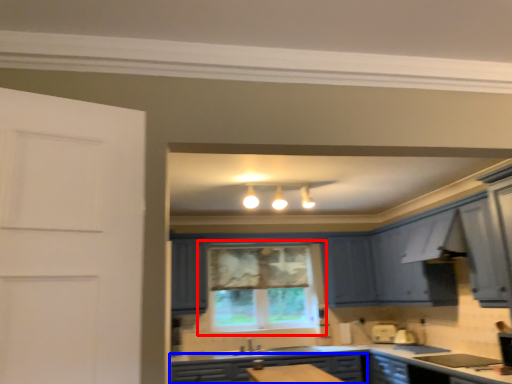
Question: Which point is closer to the camera, window (highlighted by a red box) or cabinetry (highlighted by a blue box)?

Choices:
 (A) window
 (B) cabinetry

Answer: (B)